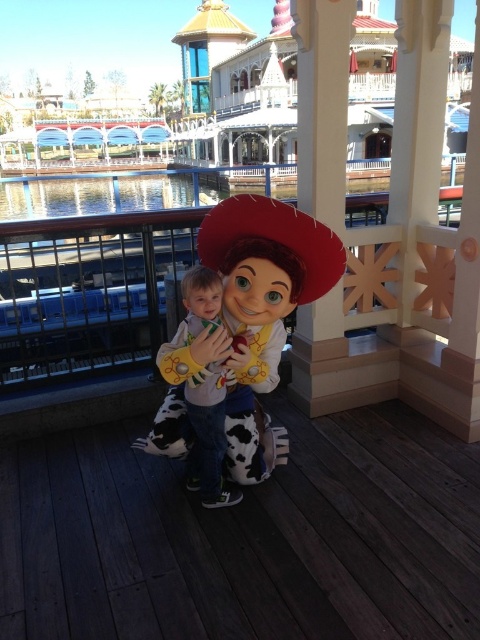
Can you confirm if wooden deck at center is thinner than cowboy hat at center?

No.

Can you confirm if wooden deck at center is wider than cowboy hat at center?

Yes.

Does point (8, 452) lie in front of point (236, 198)?

No, (8, 452) is behind (236, 198).

This screenshot has width=480, height=640. Identify the location of wooden deck at center. (245, 538).